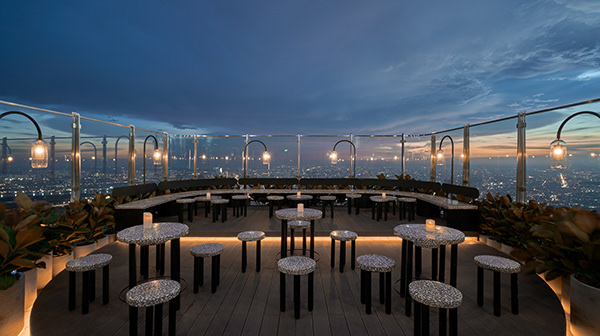
You are a GUI agent. You are given a task and a screenshot of the screen. Output one action in this format:
    pyautogui.click(x=<x>, y=<y>)
    Task: Click on the light fixtures
    The image size is (600, 336).
    Given the screenshot: What is the action you would take?
    pyautogui.click(x=558, y=156), pyautogui.click(x=441, y=152), pyautogui.click(x=336, y=156), pyautogui.click(x=263, y=156), pyautogui.click(x=157, y=155)